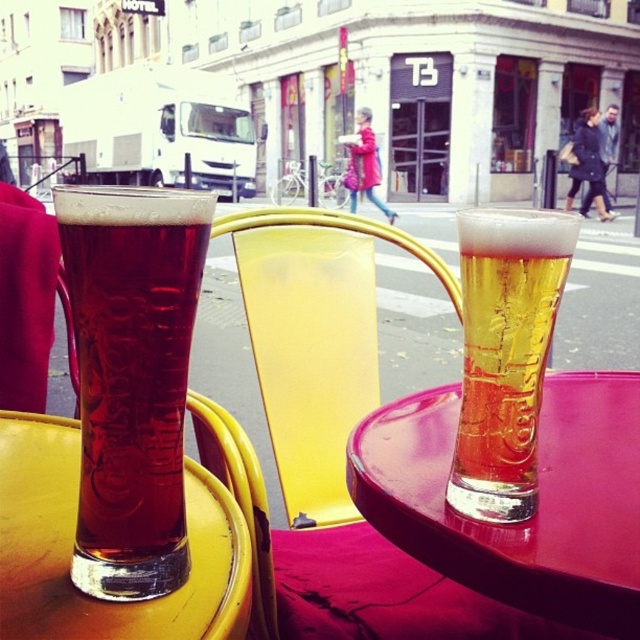
Who is taller, dark amber glass at left or translucent amber glass at right?

dark amber glass at left is taller.

Find the location of a particular element. dark amber glass at left is located at coordinates (131, 378).

Can you confirm if translucent amber glass at right is shorter than dark blue coat at upper right?

Yes.

Does translucent amber glass at right appear on the left side of dark blue coat at upper right?

Correct, you'll find translucent amber glass at right to the left of dark blue coat at upper right.

Is point (531, 317) positioned before point (593, 140)?

Yes, point (531, 317) is closer to viewer.

The image size is (640, 640). I want to click on translucent amber glass at right, so click(x=506, y=355).

Does dark amber glass at left appear on the left side of yellow plastic chair at center?

Yes, dark amber glass at left is to the left of yellow plastic chair at center.

This screenshot has height=640, width=640. What do you see at coordinates (131, 378) in the screenshot?
I see `dark amber glass at left` at bounding box center [131, 378].

The width and height of the screenshot is (640, 640). I want to click on dark amber glass at left, so click(x=131, y=378).